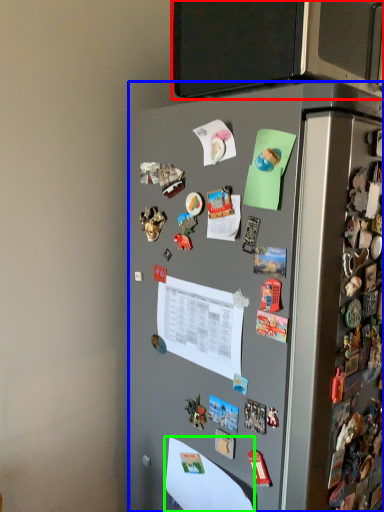
Question: Which object is positioned closest to back (highlighted by a red box)? Select from refrigerator (highlighted by a blue box) and paper (highlighted by a green box).

Choices:
 (A) refrigerator
 (B) paper

Answer: (A)